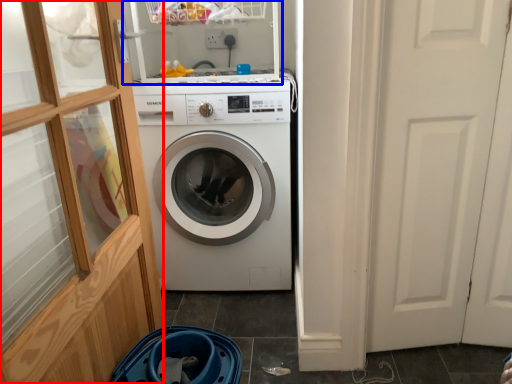
Question: Which point is closer to the camera, glass door (highlighted by a red box) or shelf (highlighted by a blue box)?

Choices:
 (A) glass door
 (B) shelf

Answer: (A)